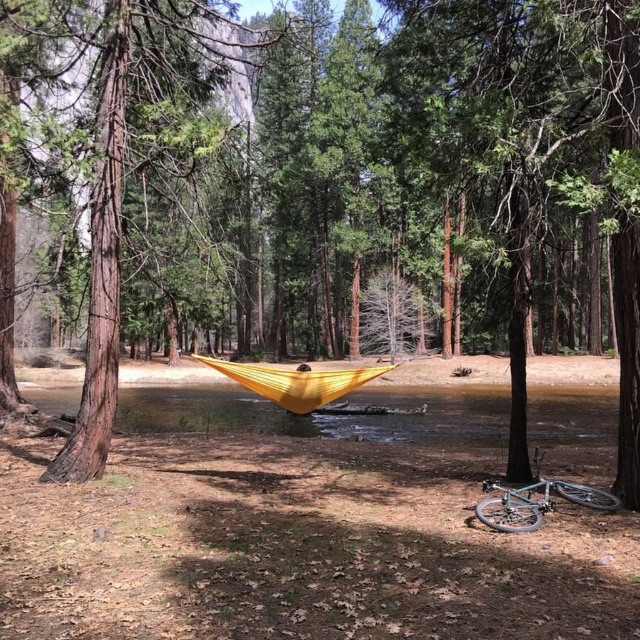
Question: Is brown rough tree trunk at left to the right of teal metallic bicycle at lower right from the viewer's perspective?

Choices:
 (A) yes
 (B) no

Answer: (B)

Question: Which object appears closest to the camera in this image?

Choices:
 (A) yellow fabric hammock at center
 (B) brown rough tree trunk at left
 (C) teal metallic bicycle at lower right

Answer: (C)

Question: Which point appears closest to the camera in this image?

Choices:
 (A) (330, 380)
 (B) (52, 68)

Answer: (A)

Question: Observing the image, what is the correct spatial positioning of brown rough tree trunk at left in reference to yellow fabric hammock at center?

Choices:
 (A) above
 (B) below

Answer: (A)

Question: Which is nearer to the brown rough tree trunk at left?

Choices:
 (A) teal metallic bicycle at lower right
 (B) yellow fabric hammock at center

Answer: (B)

Question: Is yellow fabric hammock at center to the left of teal metallic bicycle at lower right from the viewer's perspective?

Choices:
 (A) no
 (B) yes

Answer: (B)